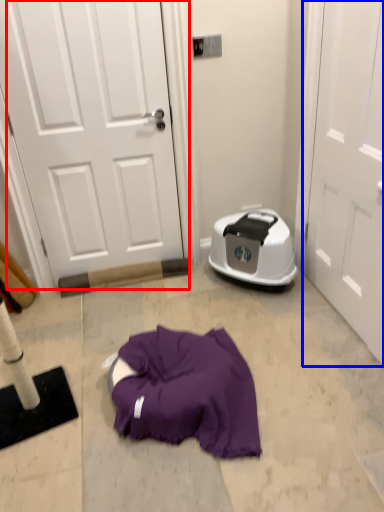
Question: Which object appears farthest to the camera in this image, door (highlighted by a red box) or door (highlighted by a blue box)?

Choices:
 (A) door
 (B) door

Answer: (A)